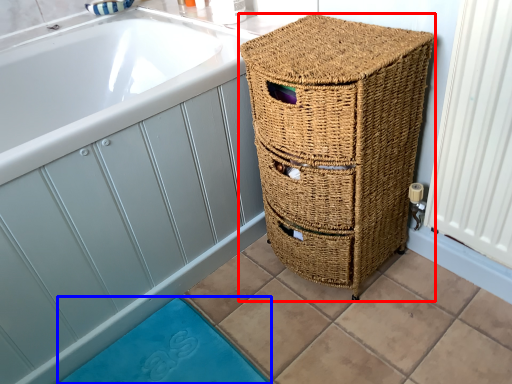
Question: Which point is further to the camera, furniture (highlighted by a red box) or bath mat (highlighted by a blue box)?

Choices:
 (A) furniture
 (B) bath mat

Answer: (B)